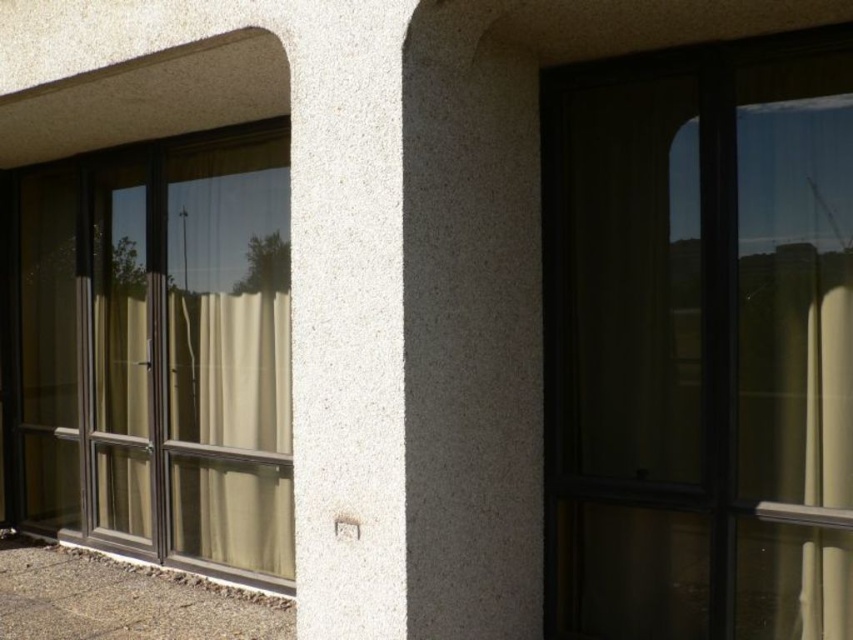
You are standing outside the building and want to enter through either the transparent glass window at right or the transparent glass screen door at left. Which entrance is wider so you can walk through comfortably?

The transparent glass screen door at left is wider than the transparent glass window at right, so it is more suitable for comfortable passage.

You are standing in front of the building and notice the transparent glass window at right. Based on its position, can you determine if it is on the east or west side of the building?

The transparent glass window at right is located at point (699, 342), which corresponds to its position on the building. However, without additional information about the building orientation or the direction you are facing, it is impossible to definitively determine if it is on the east or west side.